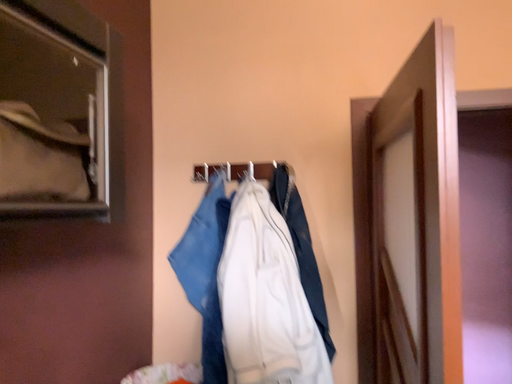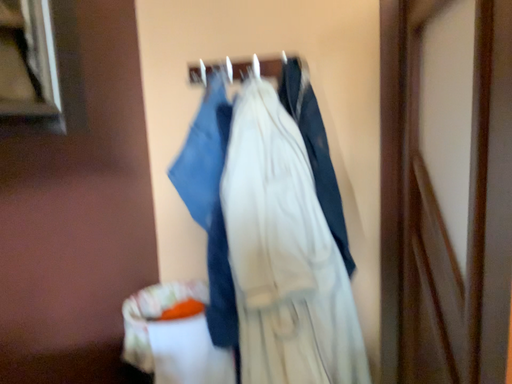
Question: Which way did the camera rotate in the video?

Choices:
 (A) rotated upward
 (B) rotated downward

Answer: (B)